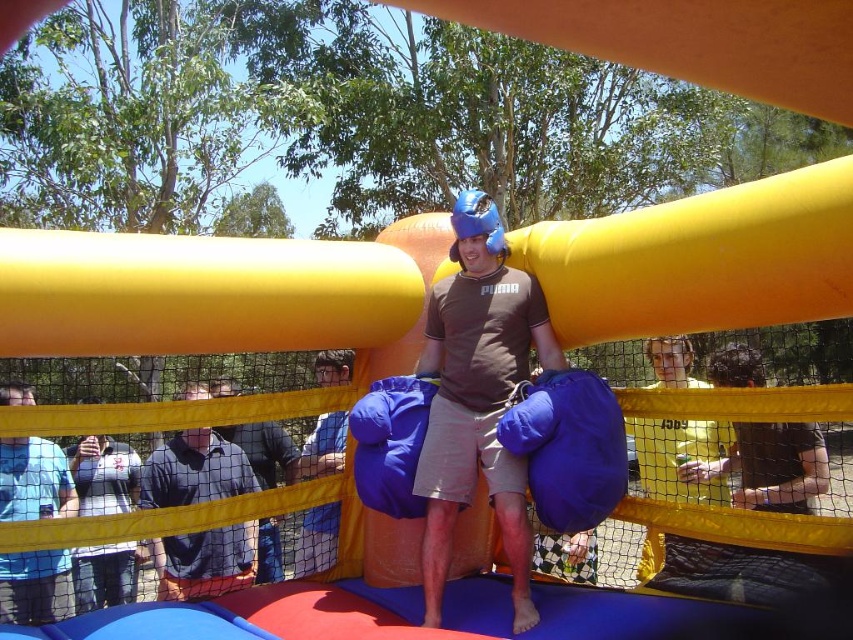
Is blue t-shirt at center shorter than dark blue shirt at center?

Incorrect, blue t-shirt at center's height does not fall short of dark blue shirt at center's.

Can you confirm if blue t-shirt at center is wider than dark blue shirt at center?

Incorrect, blue t-shirt at center's width does not surpass dark blue shirt at center's.

Identify the location of blue t-shirt at center. (33, 481).

I want to click on blue t-shirt at center, so click(33, 481).

Is matte brown t-shirt at center shorter than blue fabric bag at center?

No, matte brown t-shirt at center is not shorter than blue fabric bag at center.

I want to click on matte brown t-shirt at center, so [479, 396].

Image resolution: width=853 pixels, height=640 pixels. I want to click on matte brown t-shirt at center, so click(x=479, y=396).

Measure the distance from white matte shirt at center to blue fabric bag at center.

They are 1.82 meters apart.

Can you confirm if white matte shirt at center is positioned below blue fabric bag at center?

Correct, white matte shirt at center is located below blue fabric bag at center.

The image size is (853, 640). Describe the element at coordinates (103, 474) in the screenshot. I see `white matte shirt at center` at that location.

Locate an element on the screen. The image size is (853, 640). white matte shirt at center is located at coordinates (103, 474).